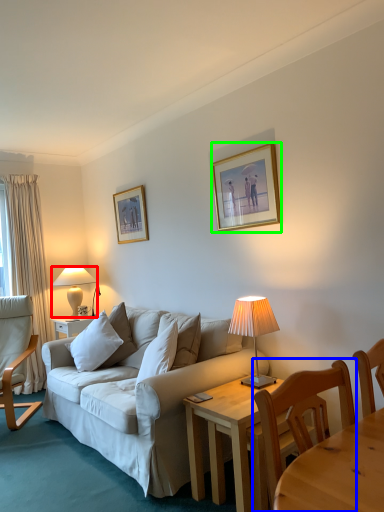
Question: Which is nearer to the lamp (highlighted by a red box)? chair (highlighted by a blue box) or picture frame (highlighted by a green box).

Choices:
 (A) chair
 (B) picture frame

Answer: (B)